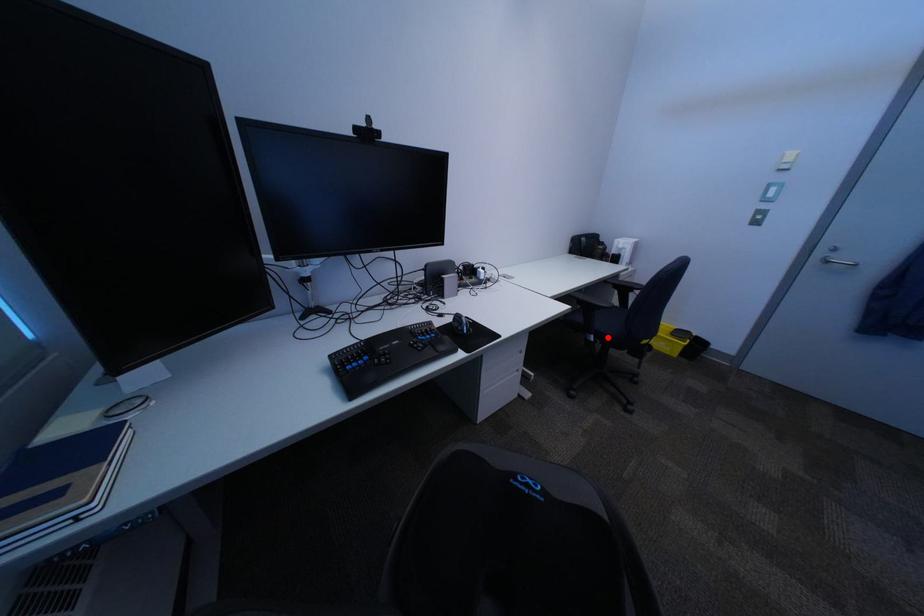
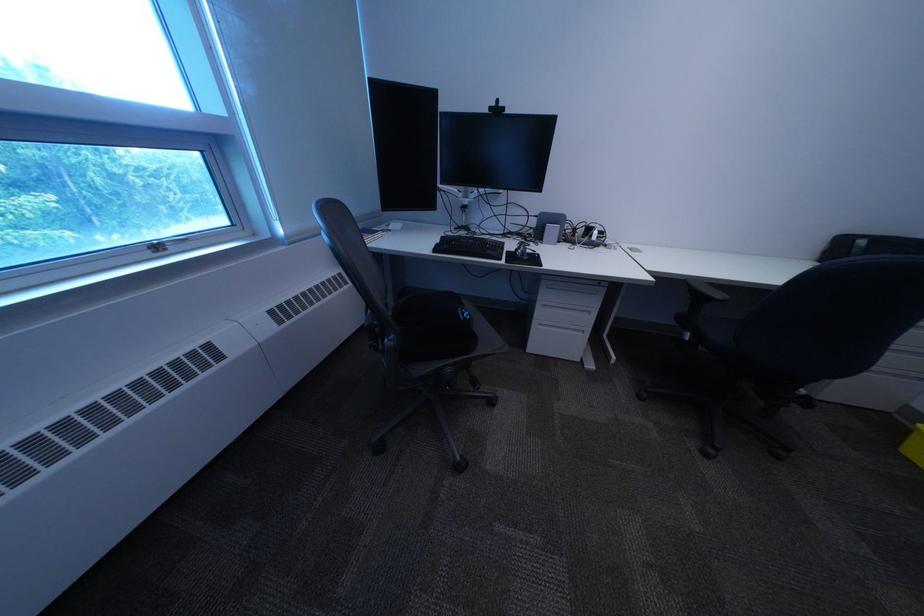
In the second image, find the point that corresponds to the highlighted location in the first image.

(704, 336)